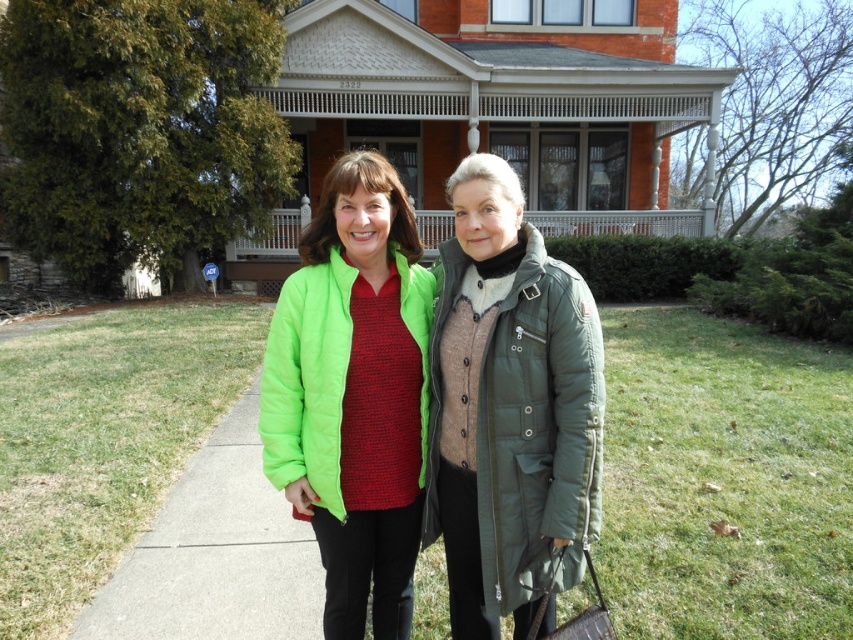
You are a tailor measuring the distance between two jackets for a fitting. The jackets are the green quilted jacket at center and the matte green puffer jacket at center. Can you fit a 12 inch ruler between them?

The distance between the green quilted jacket at center and the matte green puffer jacket at center is 12.47 inches, so yes, a 12 inch ruler can fit between them as the space is slightly larger than the ruler.

You are a delivery robot with a width of 1 meter. You are positioned at the matte green puffer jacket at center and need to move to the green matte pavement at lower left. Can you navigate the space between them without any obstacles?

The distance between the matte green puffer jacket at center and the green matte pavement at lower left is 1.24 meters. Since the robot is 1 meter wide, it can navigate the space as the distance is wider than the robot.